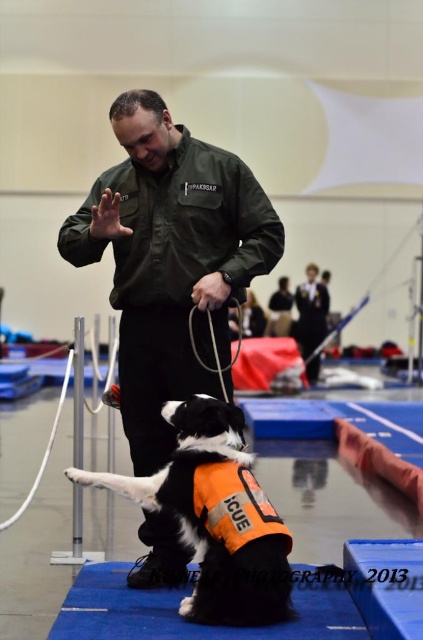
Question: Does green matte shirt at center have a greater width compared to black and white fur at center?

Choices:
 (A) no
 (B) yes

Answer: (B)

Question: Which point is closer to the camera?

Choices:
 (A) orange fabric life jacket at center
 (B) green matte shirt at center
 (C) dark blue uniform at center
 (D) black and white fur at center

Answer: (D)

Question: Which object appears closest to the camera in this image?

Choices:
 (A) orange fabric life jacket at center
 (B) black and white fur at center
 (C) dark blue uniform at center
 (D) green matte shirt at center

Answer: (B)

Question: Is orange fabric life jacket at center in front of dark blue uniform at center?

Choices:
 (A) yes
 (B) no

Answer: (A)

Question: Is black and white fur at center in front of orange fabric life jacket at center?

Choices:
 (A) yes
 (B) no

Answer: (A)

Question: Which of these objects is positioned closest to the green matte shirt at center?

Choices:
 (A) dark blue uniform at center
 (B) orange fabric life jacket at center
 (C) black and white fur at center

Answer: (C)